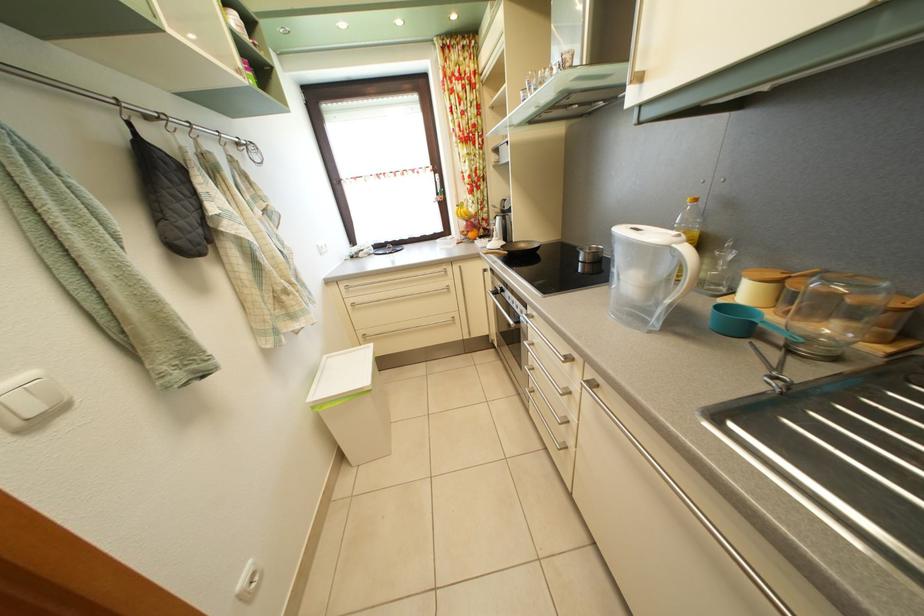
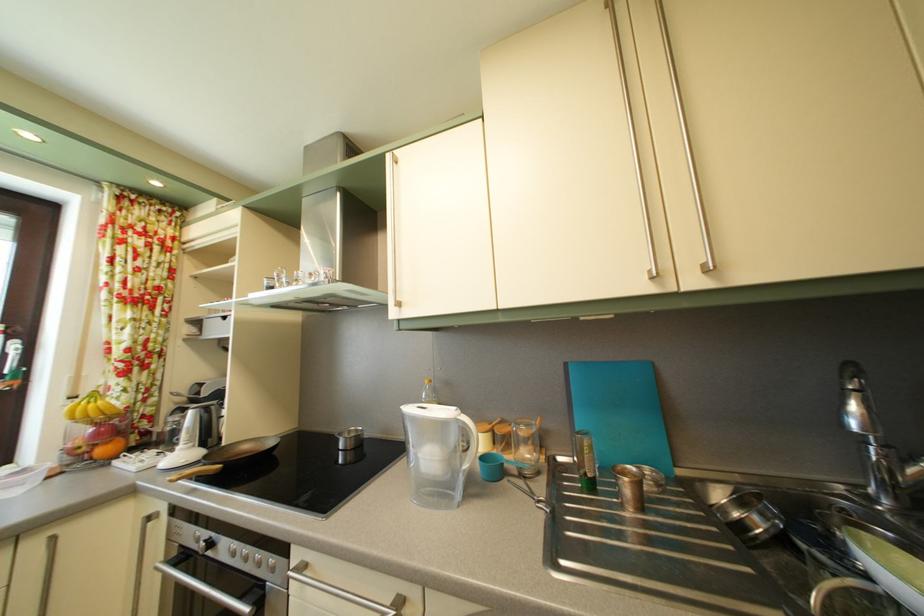
The first image is from the beginning of the video and the second image is from the end. How did the camera likely rotate when shooting the video?

The camera rotated toward right-up.